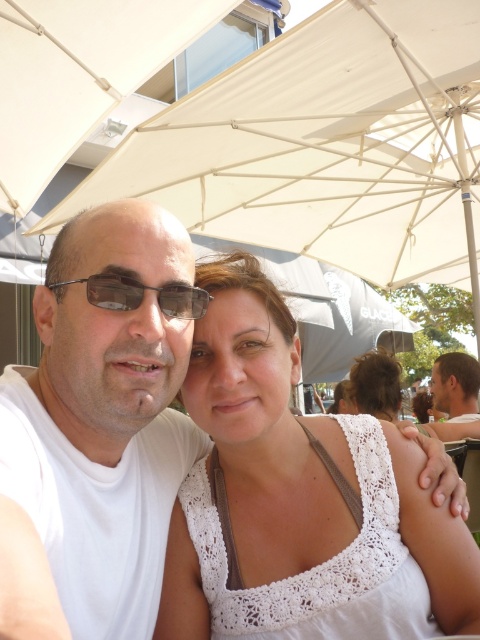
Which of these two, white matte t-shirt at center or white lace tank top at center, stands taller?

Standing taller between the two is white matte t-shirt at center.

Is white matte t-shirt at center to the right of white lace tank top at center from the viewer's perspective?

Incorrect, white matte t-shirt at center is not on the right side of white lace tank top at center.

Who is more forward, (x=60, y=273) or (x=184, y=538)?

Point (x=60, y=273)

You are a GUI agent. You are given a task and a screenshot of the screen. Output one action in this format:
    pyautogui.click(x=<x>, y=<y>)
    Task: Click on the white matte t-shirt at center
    
    Given the screenshot: What is the action you would take?
    97,429

Based on the photo, who is more forward, (x=162, y=467) or (x=72, y=122)?

Point (x=162, y=467) is more forward.

Is white matte t-shirt at center wider than beige fabric umbrella at upper center?

Incorrect, white matte t-shirt at center's width does not surpass beige fabric umbrella at upper center's.

What are the coordinates of `white matte t-shirt at center` in the screenshot? It's located at (97, 429).

Is white fabric umbrella at upper center above white lace tank top at center?

Indeed, white fabric umbrella at upper center is positioned over white lace tank top at center.

Which of these two, white fabric umbrella at upper center or white lace tank top at center, stands shorter?

Standing shorter between the two is white lace tank top at center.

What do you see at coordinates (327, 145) in the screenshot? This screenshot has height=640, width=480. I see `white fabric umbrella at upper center` at bounding box center [327, 145].

Locate an element on the screen. The height and width of the screenshot is (640, 480). white fabric umbrella at upper center is located at coordinates 327,145.